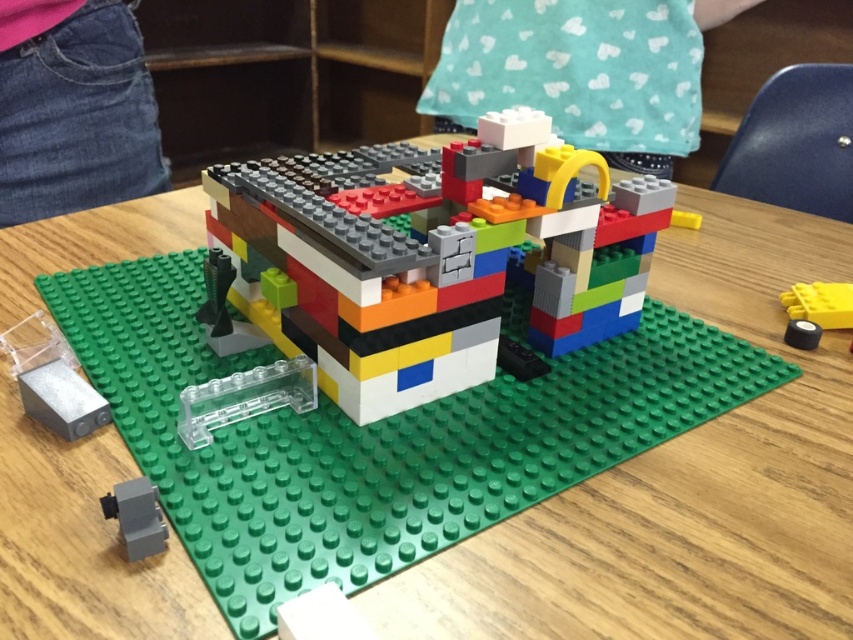
You are a photographer setting up a shoot for a LEGO advertisement. You need to ensure that the white matte shirt at upper center and the denim jeans at lower left are visible in the frame. Based on their positions, which object should you focus on first to capture both in the shot?

The white matte shirt at upper center is taller than the denim jeans at lower left, so focusing on the white matte shirt at upper center first would help ensure both are in the frame since it occupies a higher position in the image.

You are holding a white matte shirt at upper center and want to place it on the LEGO structure. The shirt is 1.47 meters away from the LEGO structure. Can you reach it without moving your position?

The white matte shirt at upper center is 1.47 meters away from the LEGO structure. Since the shirt is placed at a distance of 1.47 meters, you would need to move closer to reach it unless you have an unusually long arm span.

You are looking at the LEGO hamburger on the green baseplate. There are two points marked on the image, one at coordinates point (689, 80) and the other at point (849, 304). Which point is closer to you?

Point (689, 80) is further to the viewer than point (849, 304), so the point closer to you is point (849, 304).